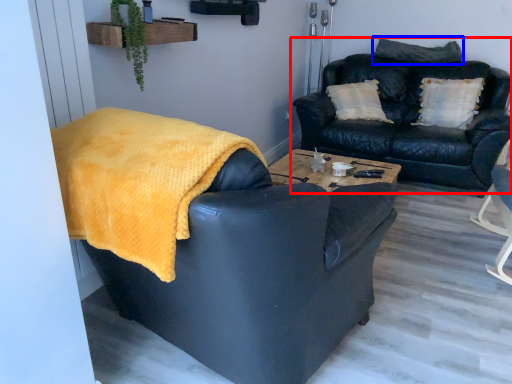
Question: Which of the following is the farthest to the observer, studio couch (highlighted by a red box) or pillow (highlighted by a blue box)?

Choices:
 (A) studio couch
 (B) pillow

Answer: (B)